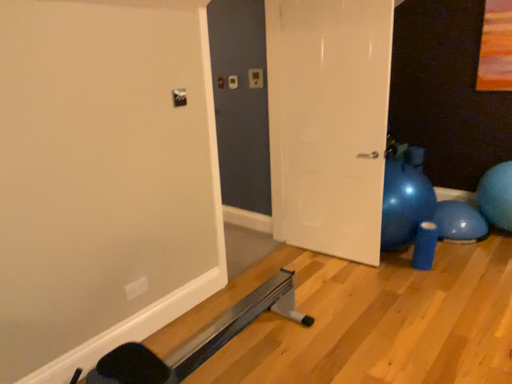
Question: From their relative heights in the image, would you say white glossy door at center is taller or shorter than blue rubber ball at right?

Choices:
 (A) tall
 (B) short

Answer: (A)

Question: Is point (298, 228) closer or farther from the camera than point (501, 185)?

Choices:
 (A) closer
 (B) farther

Answer: (B)

Question: From a real-world perspective, is white glossy door at center positioned above or below blue rubber ball at right?

Choices:
 (A) below
 (B) above

Answer: (B)

Question: From their relative heights in the image, would you say blue rubber ball at right is taller or shorter than white glossy door at center?

Choices:
 (A) tall
 (B) short

Answer: (B)

Question: Considering the relative positions of blue rubber ball at right and white glossy door at center in the image provided, is blue rubber ball at right to the left or to the right of white glossy door at center?

Choices:
 (A) right
 (B) left

Answer: (A)

Question: From the image's perspective, is blue rubber ball at right positioned above or below white glossy door at center?

Choices:
 (A) above
 (B) below

Answer: (B)

Question: From a real-world perspective, is blue rubber ball at right above or below white glossy door at center?

Choices:
 (A) below
 (B) above

Answer: (A)